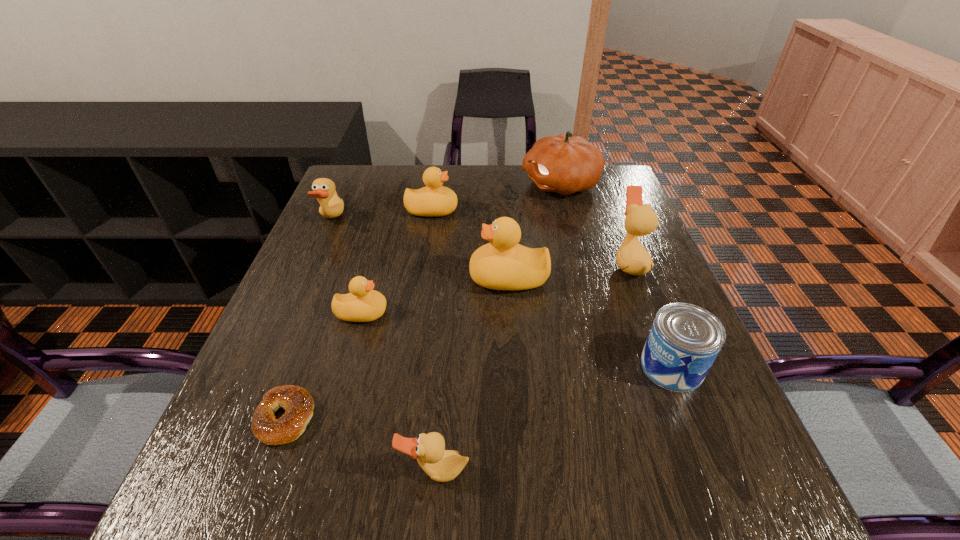
The height and width of the screenshot is (540, 960). I want to click on vacant space at the near edge of the desktop, so click(634, 518).

At what (x,y) coordinates should I click in order to perform the action: click on vacant space at the left edge. Please return your answer as a coordinate pair (x, y). Image resolution: width=960 pixels, height=540 pixels. Looking at the image, I should click on (323, 279).

This screenshot has width=960, height=540. What are the coordinates of `vacant area at the right edge` in the screenshot? It's located at (627, 329).

At what (x,y) coordinates should I click in order to perform the action: click on free space at the near left corner of the desktop. Please return your answer as a coordinate pair (x, y). The image size is (960, 540). Looking at the image, I should click on (228, 483).

At what (x,y) coordinates should I click in order to perform the action: click on vacant region between the can and the brown bagel. Please return your answer as a coordinate pair (x, y). Image resolution: width=960 pixels, height=540 pixels. Looking at the image, I should click on (479, 392).

Where is `blank region between the second farthest yellow duck and the second biggest yellow duck`? This screenshot has width=960, height=540. blank region between the second farthest yellow duck and the second biggest yellow duck is located at coordinates (470, 244).

Identify the location of unoccupied area between the second nearest yellow duck and the brown bagel. (397, 348).

I want to click on vacant space that's between the bagel and the pumpkin, so click(x=423, y=301).

Find the location of `vacant space that's between the rightmost duck and the biggest yellow duck`. vacant space that's between the rightmost duck and the biggest yellow duck is located at coordinates (568, 271).

Where is `free area in between the pumpkin and the second tan duck from left to right`? The image size is (960, 540). free area in between the pumpkin and the second tan duck from left to right is located at coordinates (497, 328).